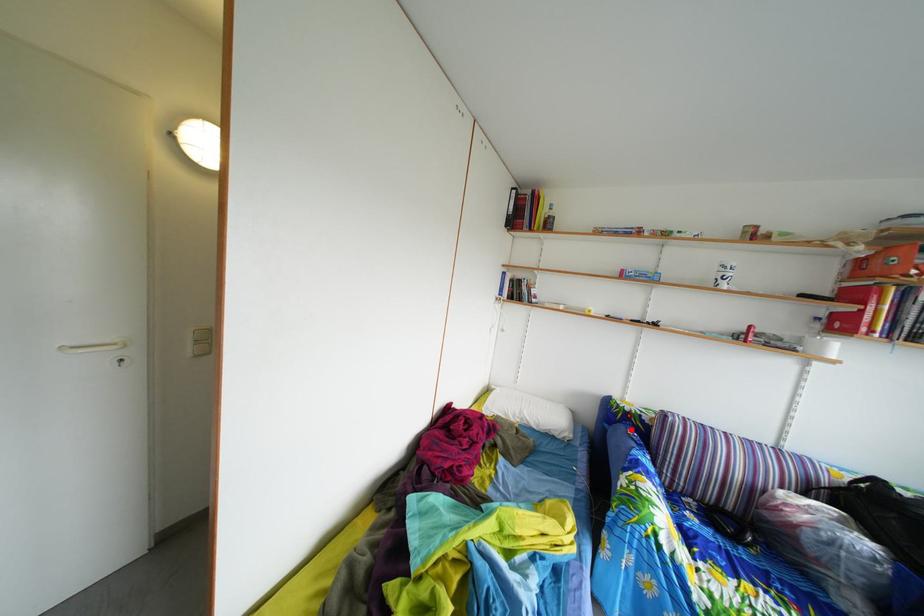
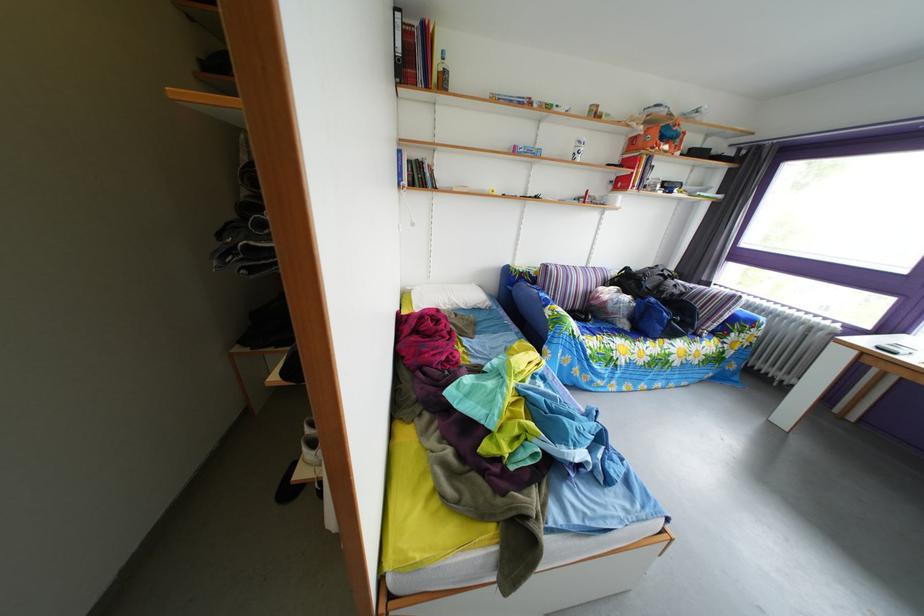
Where in the second image is the point corresponding to the highlighted location from the first image?

(529, 289)